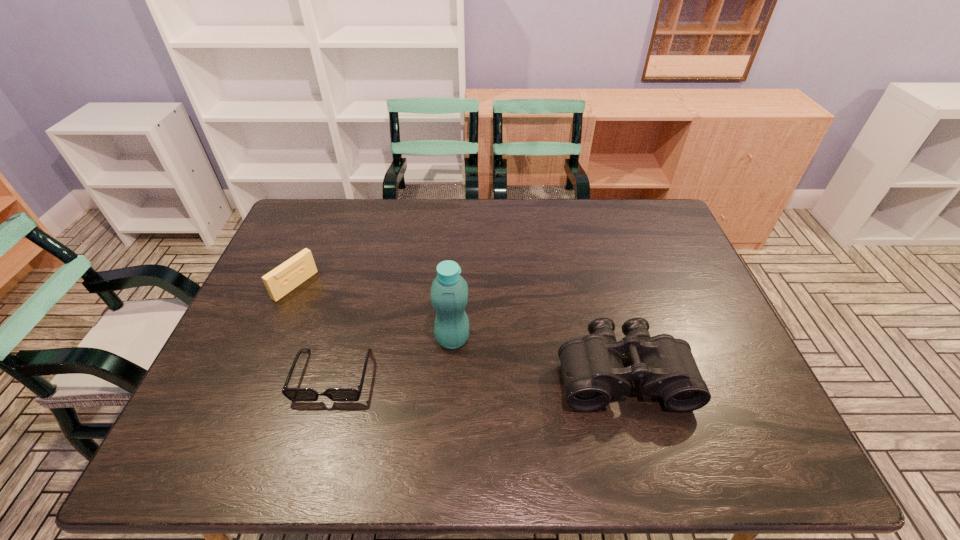
Locate an element on the screen. The image size is (960, 540). free space between the shortest object and the second object from right to left is located at coordinates (393, 357).

Find the location of `free point between the second object from left to right and the second tallest object`. free point between the second object from left to right and the second tallest object is located at coordinates (478, 375).

Locate an element on the screen. the closest object to the farthest object is located at coordinates (293, 394).

Identify which object is located as the third nearest to the binoculars. Please provide its 2D coordinates. Your answer should be formatted as a tuple, i.e. [(x, y)], where the tuple contains the x and y coordinates of a point satisfying the conditions above.

[(280, 281)]